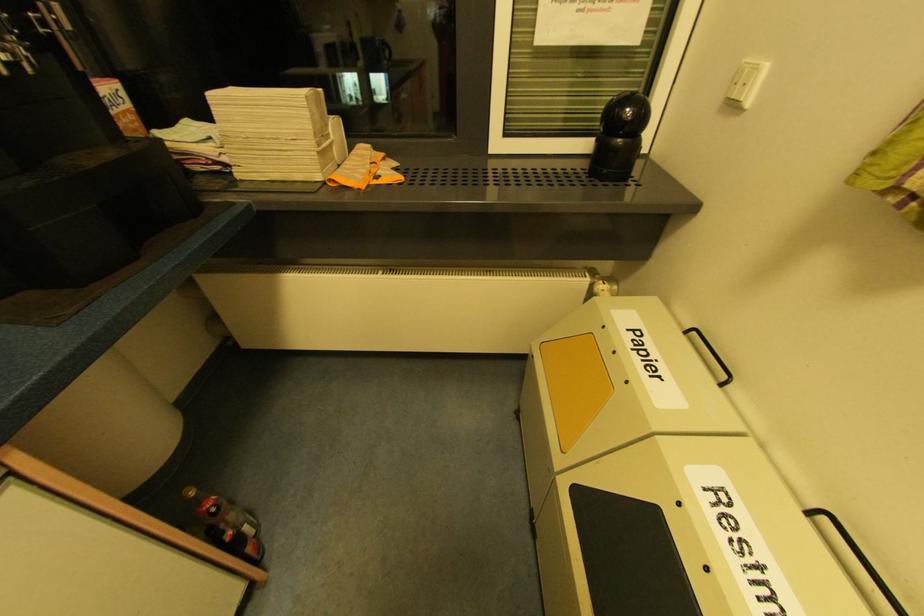
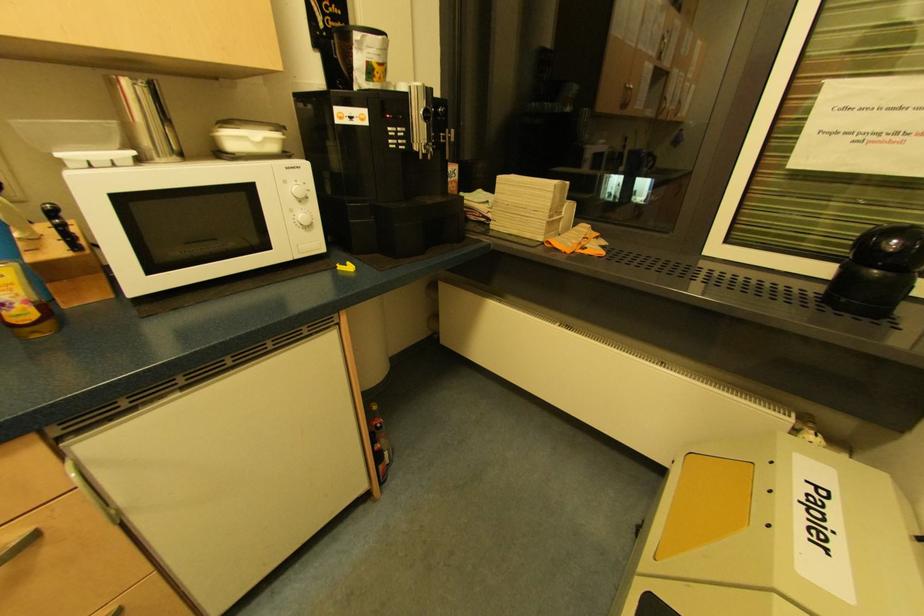
Where in the second image is the point corresponding to [124,100] from the first image?

(457, 175)